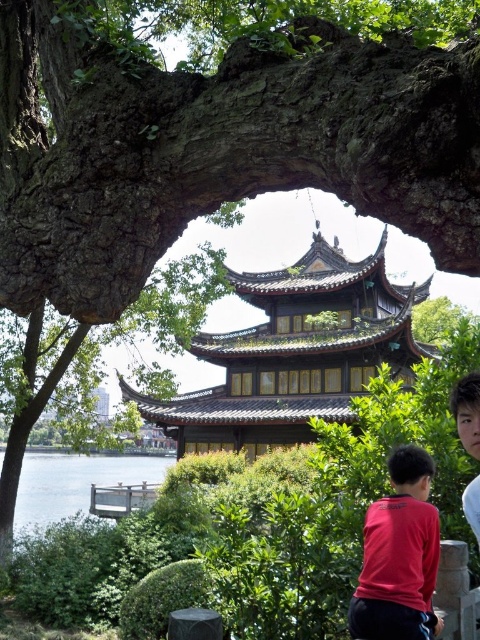
Question: Is brown wooden pagoda at center thinner than red matte shirt at lower right?

Choices:
 (A) no
 (B) yes

Answer: (A)

Question: Which object is the farthest from the red matte shirt at lower right?

Choices:
 (A) red shirt at lower right
 (B) clear water at lower left
 (C) brown wooden pagoda at center

Answer: (C)

Question: Where is clear water at lower left located in relation to red shirt at lower right in the image?

Choices:
 (A) left
 (B) right

Answer: (A)

Question: Which object appears closest to the camera in this image?

Choices:
 (A) clear water at lower left
 (B) brown wooden pagoda at center

Answer: (A)

Question: Which object appears farthest from the camera in this image?

Choices:
 (A) red shirt at lower right
 (B) red matte shirt at lower right

Answer: (A)

Question: Is red matte shirt at lower right closer to camera compared to clear water at lower left?

Choices:
 (A) yes
 (B) no

Answer: (A)